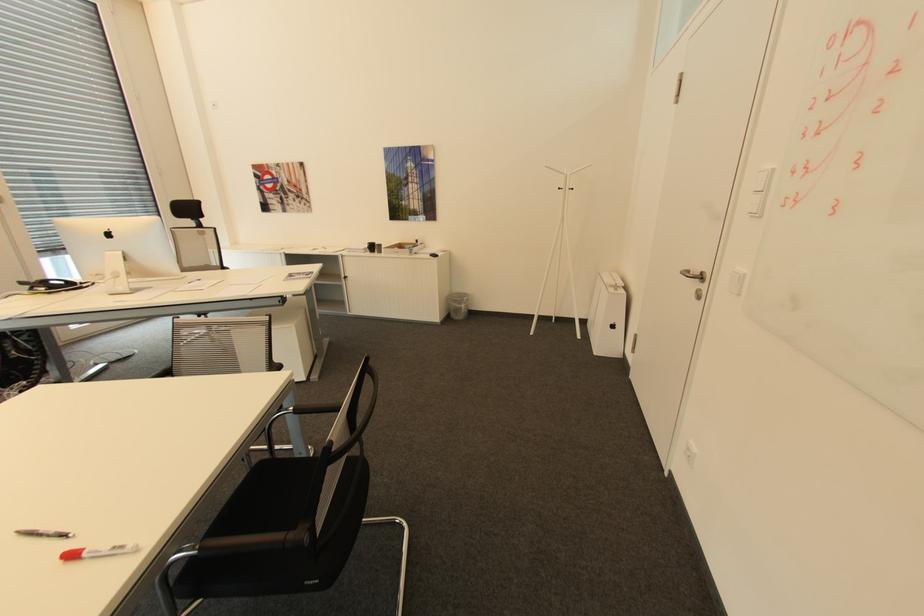
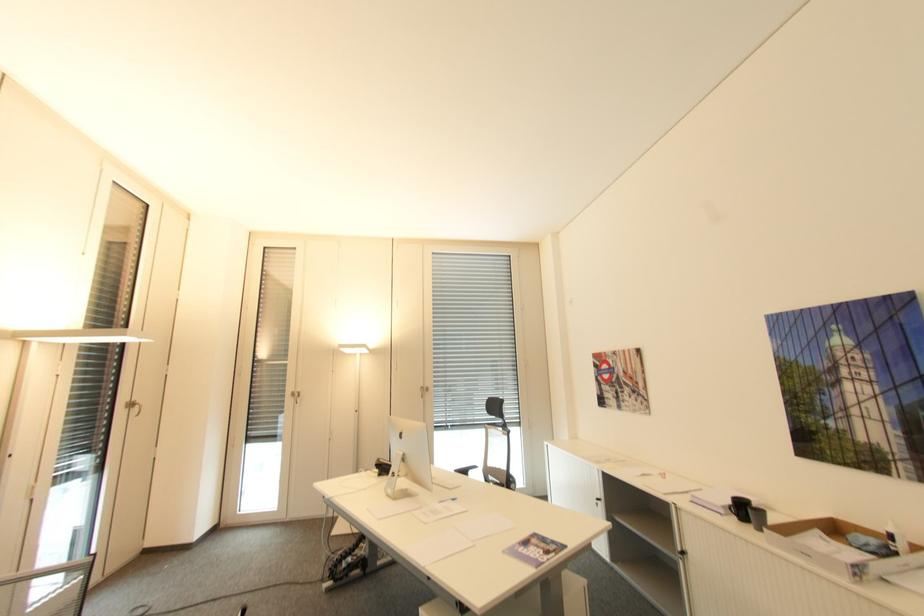
In the second image, find the point that corresponds to [288,280] in the first image.

(507, 553)